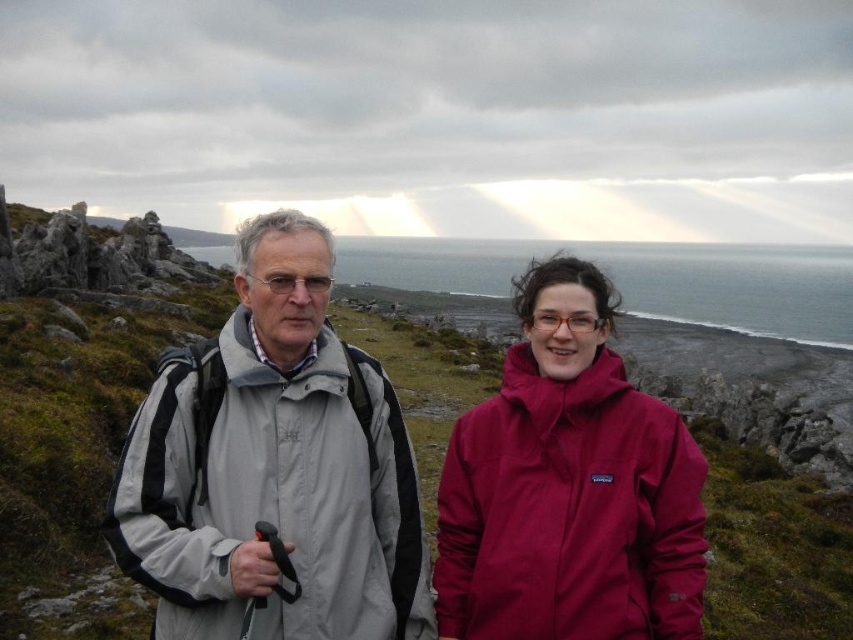
Looking at this image, is gray fabric jacket at center smaller than burgundy waterproof jacket at center?

Correct, gray fabric jacket at center occupies less space than burgundy waterproof jacket at center.

Is gray fabric jacket at center further to the viewer compared to burgundy waterproof jacket at center?

No, gray fabric jacket at center is in front of burgundy waterproof jacket at center.

Is point (247, 481) behind point (621, 541)?

No, (247, 481) is closer to viewer.

The height and width of the screenshot is (640, 853). I want to click on gray fabric jacket at center, so click(x=274, y=468).

Who is positioned more to the left, gray fabric jacket at center or gray water at center?

gray fabric jacket at center is more to the left.

Is point (289, 458) in front of point (500, 282)?

Yes.

Where is `gray fabric jacket at center`? The image size is (853, 640). gray fabric jacket at center is located at coordinates (274, 468).

Who is positioned more to the left, burgundy waterproof jacket at center or gray water at center?

Positioned to the left is burgundy waterproof jacket at center.

The height and width of the screenshot is (640, 853). I want to click on burgundy waterproof jacket at center, so click(x=569, y=486).

Identify the location of burgundy waterproof jacket at center. (569, 486).